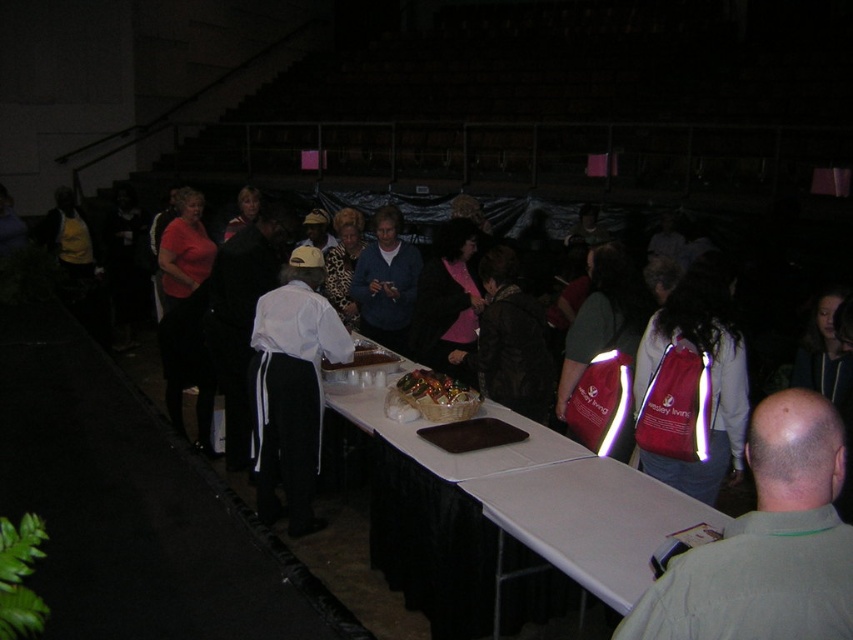
How far apart are green fabric shirt at lower right and white matte table at lower right?

green fabric shirt at lower right is 36.59 inches away from white matte table at lower right.

Can you confirm if green fabric shirt at lower right is positioned to the right of white matte table at lower right?

Yes, green fabric shirt at lower right is to the right of white matte table at lower right.

Locate an element on the screen. The height and width of the screenshot is (640, 853). green fabric shirt at lower right is located at coordinates (767, 541).

You are a GUI agent. You are given a task and a screenshot of the screen. Output one action in this format:
    pyautogui.click(x=<x>, y=<y>)
    Task: Click on the green fabric shirt at lower right
    
    Given the screenshot: What is the action you would take?
    pyautogui.click(x=767, y=541)

Is white plastic table at center shorter than white matte table at lower right?

Incorrect, white plastic table at center's height does not fall short of white matte table at lower right's.

Does white plastic table at center appear on the left side of white matte table at lower right?

Correct, you'll find white plastic table at center to the left of white matte table at lower right.

Between point (469, 461) and point (635, 483), which one is positioned behind?

Point (469, 461)

Find the location of a particular element. This screenshot has width=853, height=640. white plastic table at center is located at coordinates (552, 497).

Can you confirm if green fabric shirt at lower right is thinner than white plastic table at center?

Indeed, green fabric shirt at lower right has a lesser width compared to white plastic table at center.

Which is more to the right, green fabric shirt at lower right or white plastic table at center?

green fabric shirt at lower right

Is point (763, 595) farther from camera compared to point (405, 426)?

No, (763, 595) is closer to viewer.

Identify the location of green fabric shirt at lower right. The height and width of the screenshot is (640, 853). (767, 541).